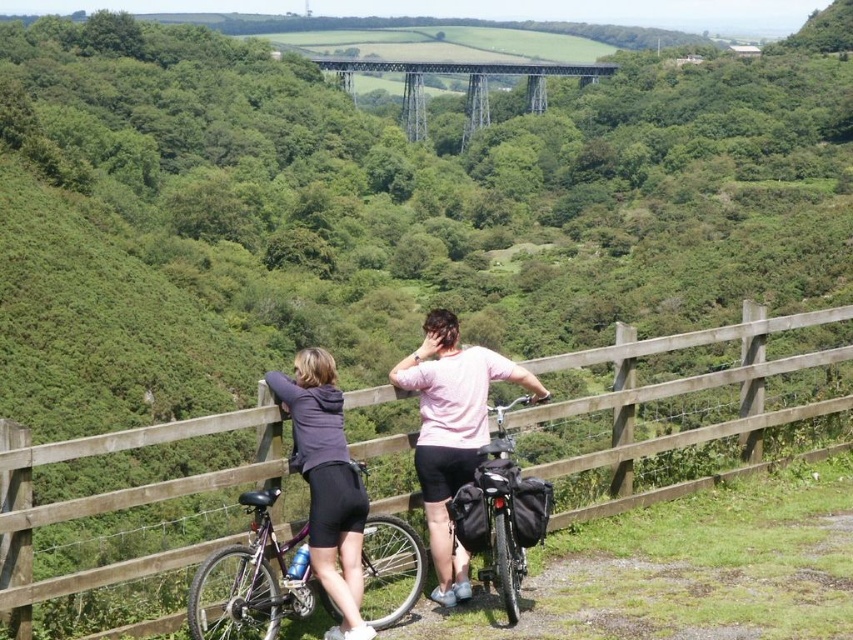
Question: Can you confirm if shiny purple bicycle at center is smaller than matte purple hoodie at center?

Choices:
 (A) yes
 (B) no

Answer: (B)

Question: Does wooden fence at center lie behind matte pink shirt at center?

Choices:
 (A) yes
 (B) no

Answer: (B)

Question: Is matte black bicycle at center thinner than metallic gray bridge at upper center?

Choices:
 (A) no
 (B) yes

Answer: (B)

Question: Which of the following is the closest to the observer?

Choices:
 (A) matte purple hoodie at center
 (B) matte black bicycle at center
 (C) wooden fence at center
 (D) shiny purple bicycle at center

Answer: (C)

Question: Which point is closer to the camera?

Choices:
 (A) matte black bicycle at center
 (B) matte pink shirt at center

Answer: (B)

Question: Which object is farther from the camera taking this photo?

Choices:
 (A) matte pink shirt at center
 (B) matte black bicycle at center
 (C) wooden fence at center

Answer: (B)